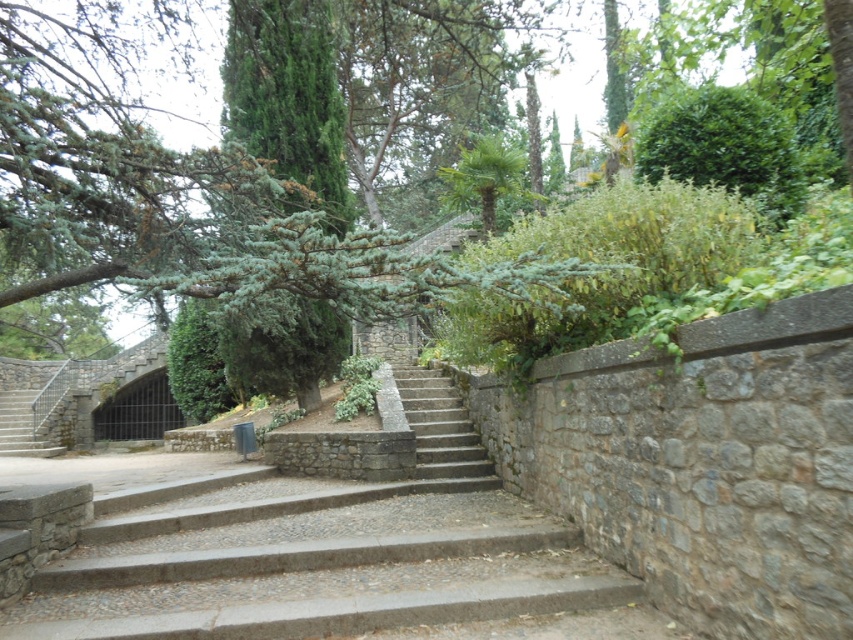
Which is in front, point (410, 586) or point (451, 400)?

Point (410, 586) is in front.

Describe the element at coordinates (337, 556) in the screenshot. I see `gray stone stairs at center` at that location.

At what (x,y) coordinates should I click in order to perform the action: click on gray stone stairs at center. Please return your answer as a coordinate pair (x, y). This screenshot has height=640, width=853. Looking at the image, I should click on (337, 556).

Identify the location of gray stone stairs at center. (337, 556).